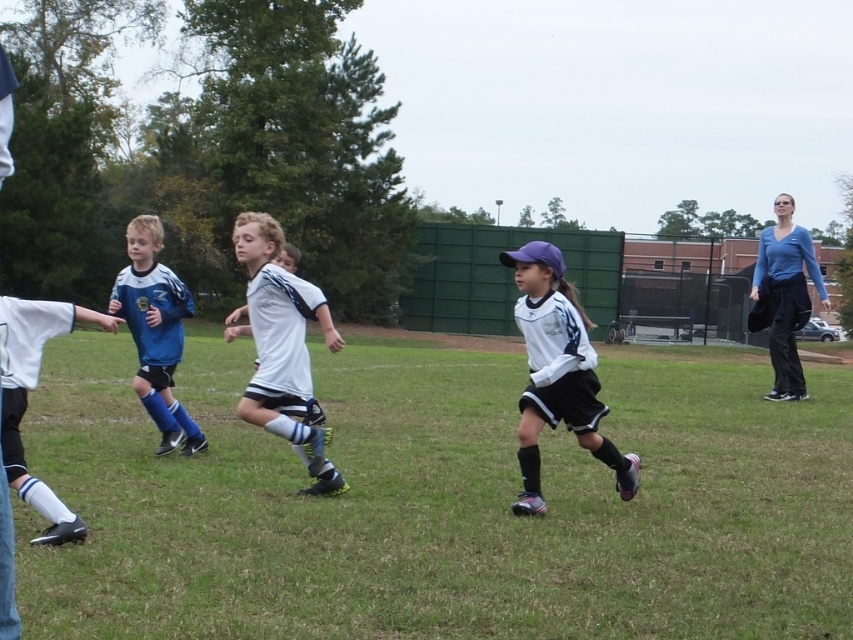
Question: Which point appears farthest from the camera in this image?

Choices:
 (A) (102, 456)
 (B) (308, 449)
 (C) (519, 440)
 (D) (813, 275)

Answer: (D)

Question: Can you confirm if white matte soccer jersey at center is positioned to the left of blue matte shirt at upper right?

Choices:
 (A) yes
 (B) no

Answer: (A)

Question: Is green grass at center positioned before white matte uniform at center?

Choices:
 (A) no
 (B) yes

Answer: (B)

Question: Estimate the real-world distances between objects in this image. Which object is closer to the white matte soccer jersey at center?

Choices:
 (A) blue matte shirt at upper right
 (B) green grass at center
 (C) blue matte soccer jersey at left

Answer: (C)

Question: Can you confirm if green grass at center is bigger than blue matte soccer jersey at left?

Choices:
 (A) yes
 (B) no

Answer: (A)

Question: Which object is positioned closest to the blue matte soccer jersey at left?

Choices:
 (A) blue matte shirt at upper right
 (B) green grass at center
 (C) white matte soccer jersey at center
 (D) white matte uniform at center

Answer: (C)